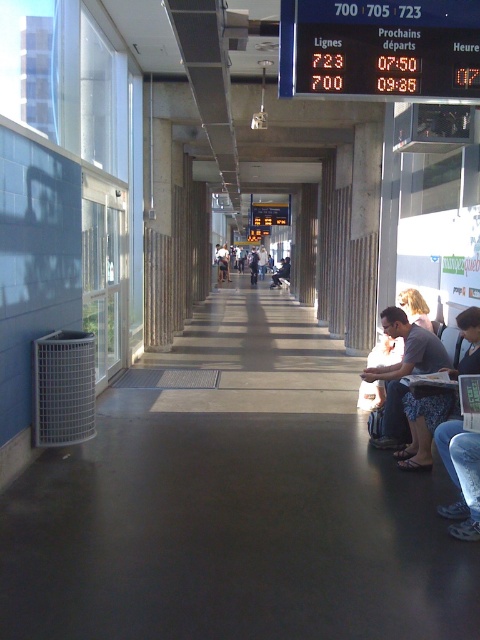
You are standing in the corridor and see the matte gray backpack at center and the white cotton shirt at center. Which item is located higher up?

The matte gray backpack at center is above the white cotton shirt at center, so it is located higher up.

You are a traveler standing in the corridor and notice a matte gray backpack at center and a white cotton shirt at center. Which item is taller?

The matte gray backpack at center is taller than the white cotton shirt at center.

You are standing in the corridor and want to place your matte gray backpack at center near the blue denim shorts at lower right. Are they positioned in a way that allows you to easily move the backpack towards the shorts?

The blue denim shorts at lower right are to the right of the matte gray backpack at center, so moving the backpack towards the shorts would require moving it to the right, which is feasible as they are positioned along the same axis.